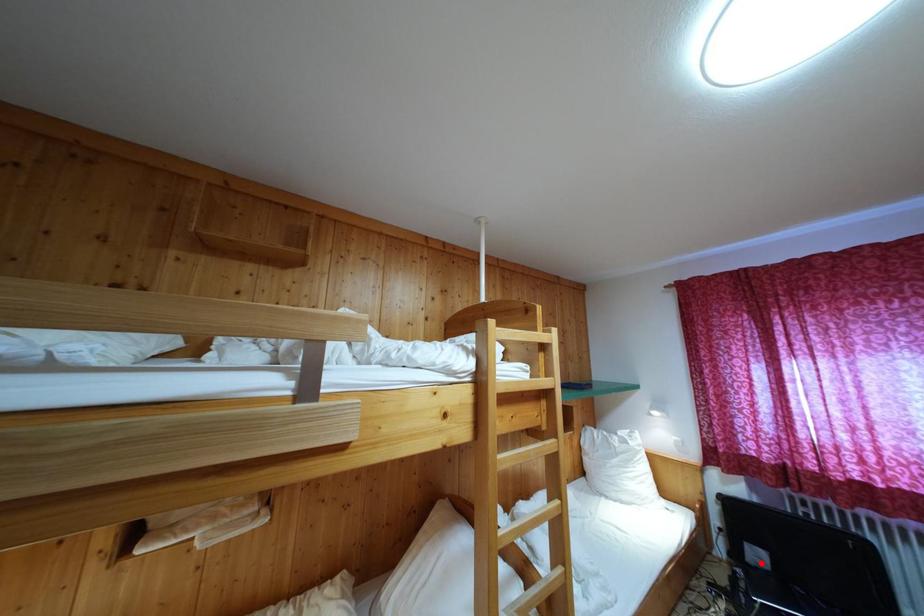
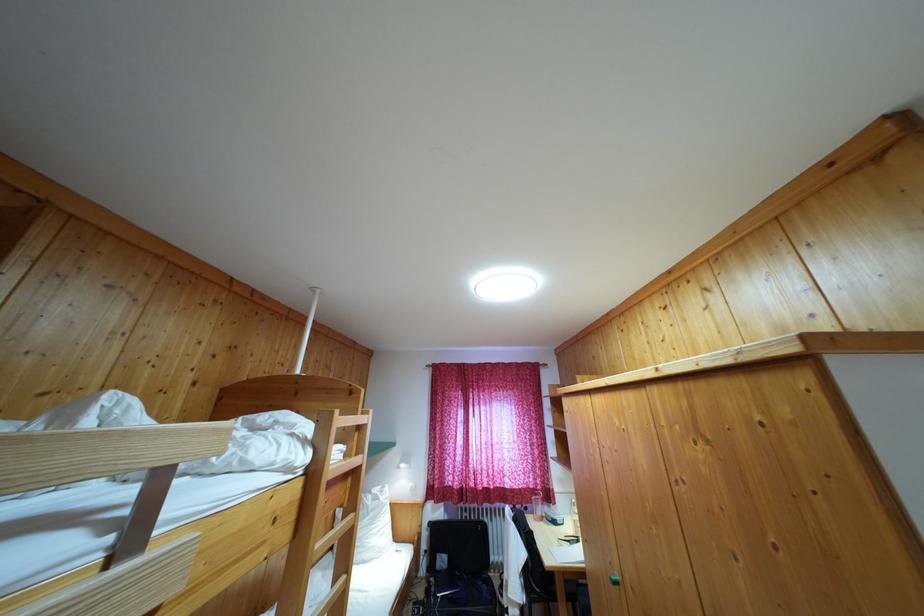
Question: I am providing you with two images of the same scene from different viewpoints. A red point is shown in image1. For the corresponding object point in image2, is it positioned nearer or farther from the camera?

Choices:
 (A) Nearer
 (B) Farther

Answer: (B)